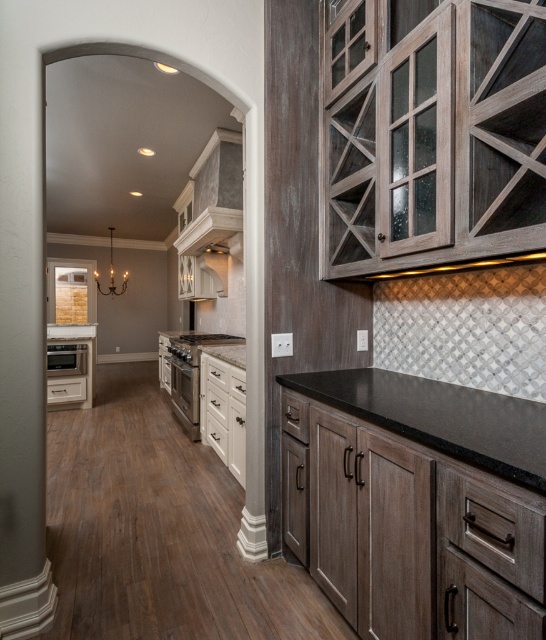
From the picture: Can you confirm if satin nickel oven at center is positioned below satin stainless steel oven at left?

Indeed, satin nickel oven at center is positioned under satin stainless steel oven at left.

Is satin nickel oven at center positioned before satin stainless steel oven at left?

Yes, satin nickel oven at center is in front of satin stainless steel oven at left.

Measure the distance between satin nickel oven at center and camera.

satin nickel oven at center and camera are 4.16 meters apart from each other.

Find the location of a particular element. satin nickel oven at center is located at coordinates (185, 394).

Does point (365, 458) come behind point (193, 410)?

No, (365, 458) is in front of (193, 410).

Who is more forward, [298,531] or [188,364]?

Point [298,531] is more forward.

Is point (473, 614) positioned after point (175, 397)?

No.

The width and height of the screenshot is (546, 640). I want to click on dark brown wood cabinet at right, so click(x=410, y=522).

From the picture: Can you confirm if black granite countertop at center is positioned to the left of satin nickel oven at center?

No, black granite countertop at center is not to the left of satin nickel oven at center.

Which of these two, black granite countertop at center or satin nickel oven at center, stands shorter?

Standing shorter between the two is black granite countertop at center.

The image size is (546, 640). I want to click on black granite countertop at center, so click(440, 417).